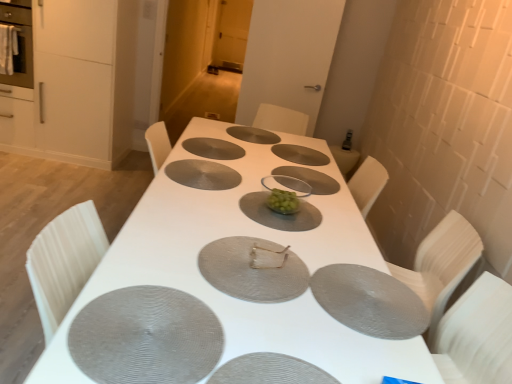
What are the coordinates of `free space between gray textured placemat at center, the fourth pizza pan viewed from the back, and metallic silver pizza pan at center, the 4th pizza pan viewed from the front` in the screenshot? It's located at (216, 208).